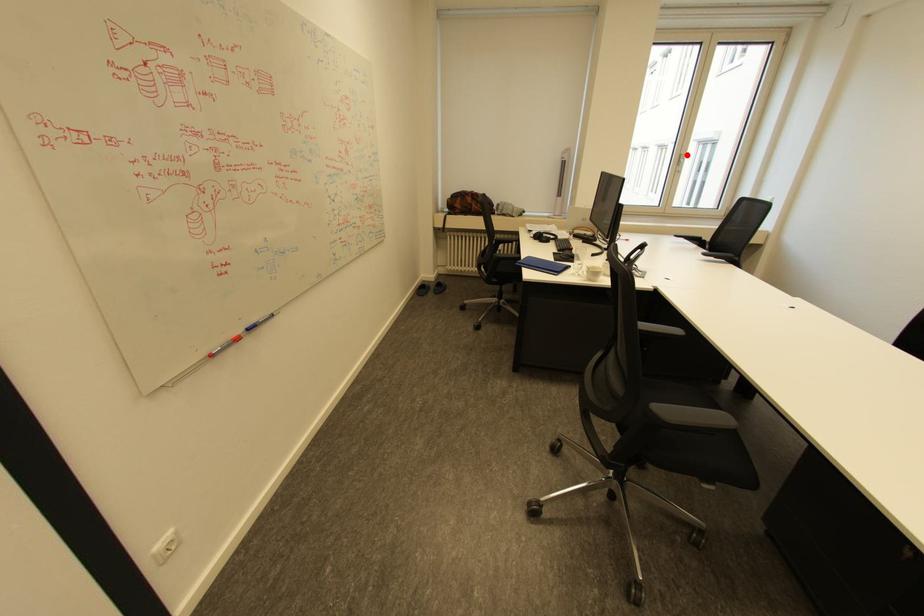
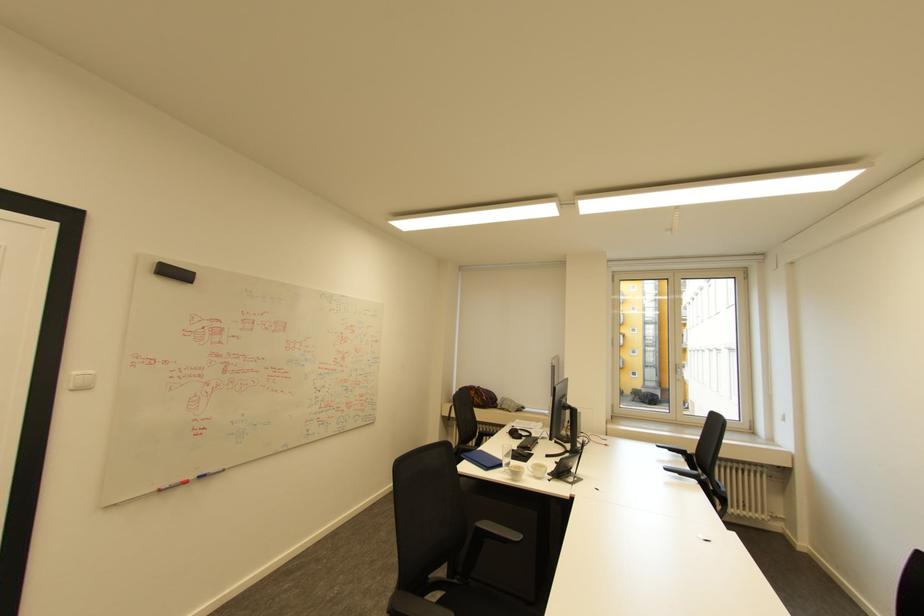
Question: I am providing you with two images of the same scene from different viewpoints. A red point is shown in image1. For the corresponding object point in image2, is it positioned nearer or farther from the camera?

Choices:
 (A) Nearer
 (B) Farther

Answer: (A)